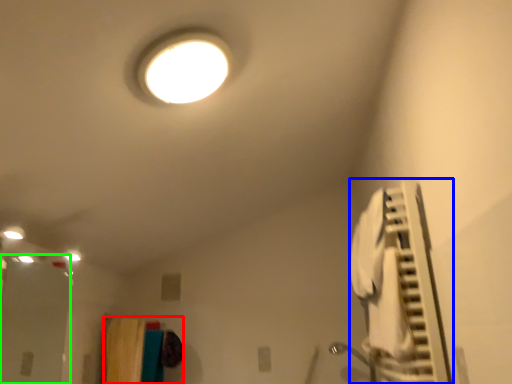
Question: Considering the real-world distances, which object is closest to laundry (highlighted by a red box)? air conditioner (highlighted by a blue box) or glass door (highlighted by a green box).

Choices:
 (A) air conditioner
 (B) glass door

Answer: (B)